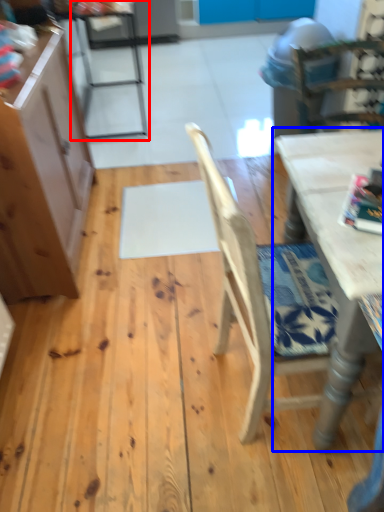
Question: Among these objects, which one is nearest to the camera, chair (highlighted by a red box) or table (highlighted by a blue box)?

Choices:
 (A) chair
 (B) table

Answer: (B)